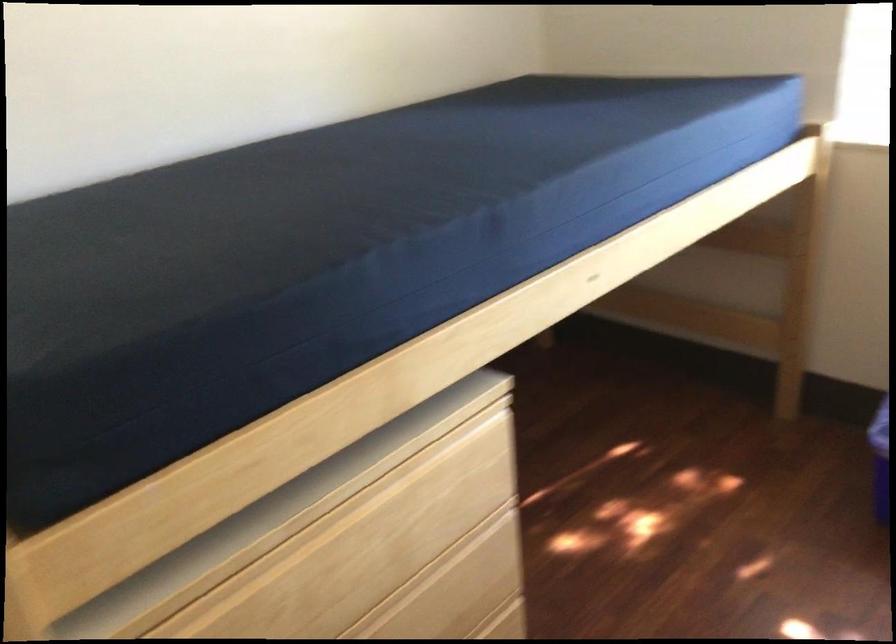
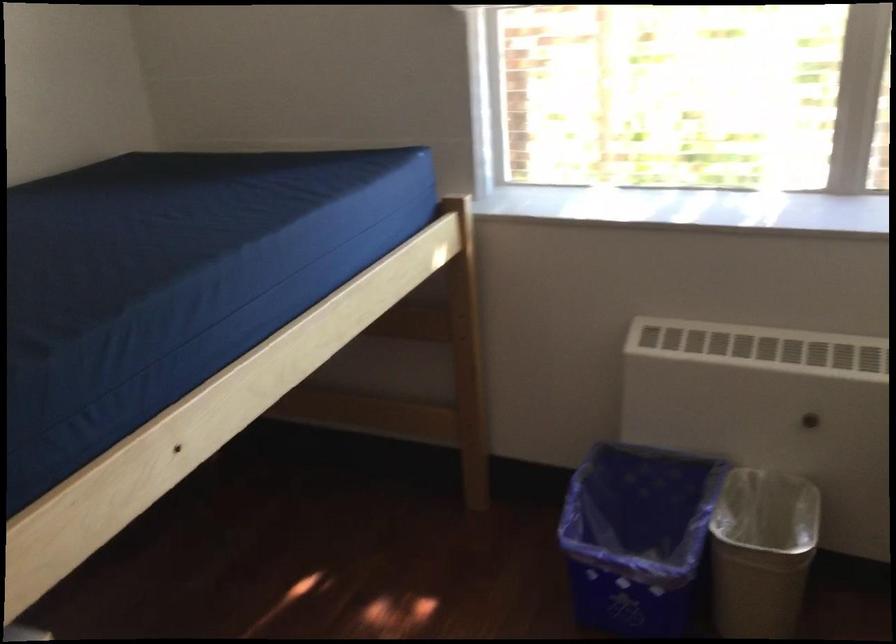
Question: The camera is either moving clockwise (left) or counter-clockwise (right) around the object. The first image is from the beginning of the video and the second image is from the end. Is the camera moving left or right when shooting the video?

Choices:
 (A) Left
 (B) Right

Answer: (A)